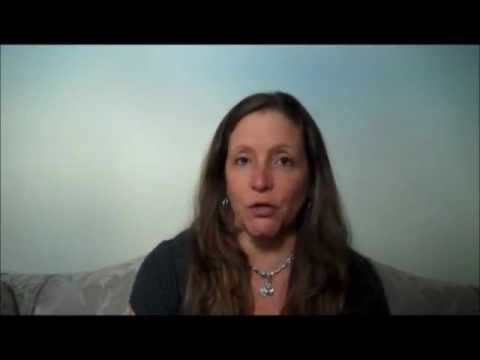
At what (x,y) coordinates should I click in order to perform the action: click on wall, bluish gray. Please return your answer as a coordinate pair (x, y). The height and width of the screenshot is (360, 480). Looking at the image, I should click on (127, 144).